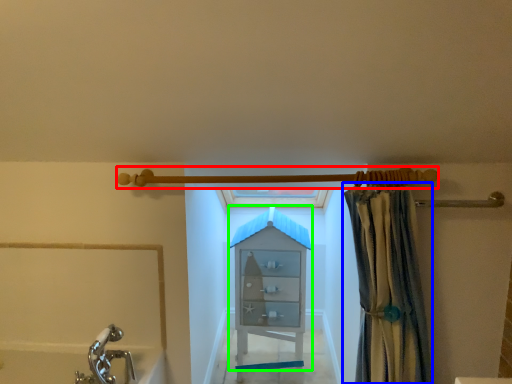
Question: Considering the real-world distances, which object is farthest from shower (highlighted by a red box)? curtain (highlighted by a blue box) or cabinet (highlighted by a green box)?

Choices:
 (A) curtain
 (B) cabinet

Answer: (B)